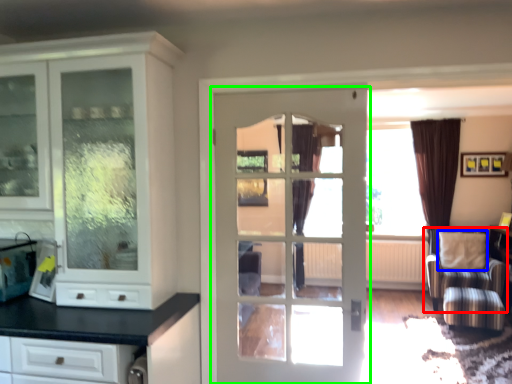
Question: Estimate the real-world distances between objects in this image. Which object is closer to chair (highlighted by a red box), pillow (highlighted by a blue box) or door (highlighted by a green box)?

Choices:
 (A) pillow
 (B) door

Answer: (A)